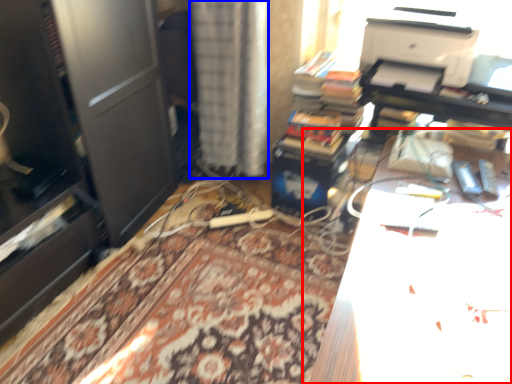
Question: Which point is closer to the camera, table (highlighted by a red box) or curtain (highlighted by a blue box)?

Choices:
 (A) table
 (B) curtain

Answer: (A)